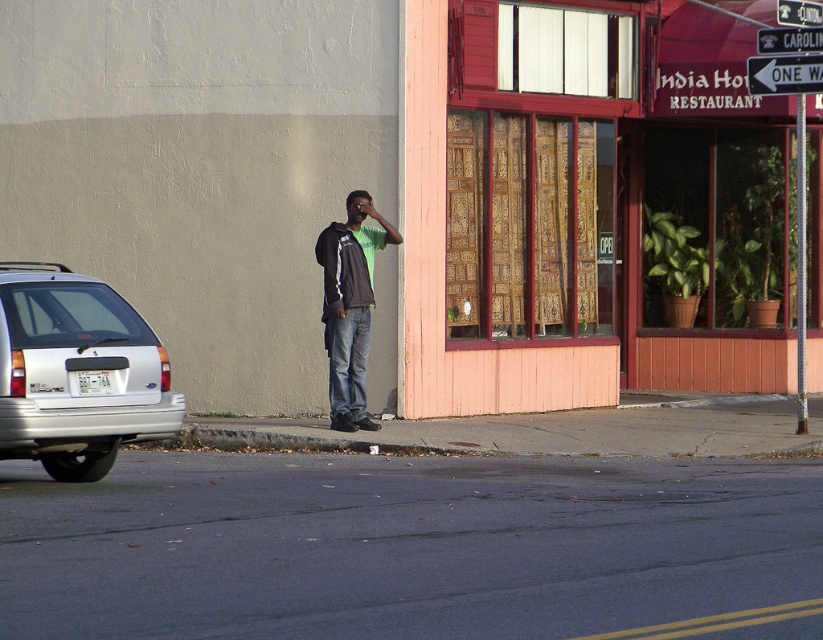
Between silver metallic hatchback at left and black plastic one way sign at upper right, which one is positioned higher?

black plastic one way sign at upper right

Does point (45, 292) come farther from viewer compared to point (808, 67)?

No, it is in front of (808, 67).

Find the location of a particular element. silver metallic hatchback at left is located at coordinates (77, 372).

Who is positioned more to the left, pink wood/paneling at center or brown jacket at center?

Positioned to the left is brown jacket at center.

Which is below, pink wood/paneling at center or brown jacket at center?

pink wood/paneling at center

Is point (491, 106) positioned behind point (324, 337)?

Yes, it is behind point (324, 337).

Image resolution: width=823 pixels, height=640 pixels. Find the location of `pink wood/paneling at center`. pink wood/paneling at center is located at coordinates (580, 209).

Can you confirm if silver metallic hatchback at left is positioned to the right of brown jacket at center?

No, silver metallic hatchback at left is not to the right of brown jacket at center.

Image resolution: width=823 pixels, height=640 pixels. Describe the element at coordinates (77, 372) in the screenshot. I see `silver metallic hatchback at left` at that location.

Which is in front, point (143, 328) or point (379, 232)?

Point (143, 328) is more forward.

At what (x,y) coordinates should I click in order to perform the action: click on silver metallic hatchback at left. Please return your answer as a coordinate pair (x, y). The height and width of the screenshot is (640, 823). Looking at the image, I should click on (77, 372).